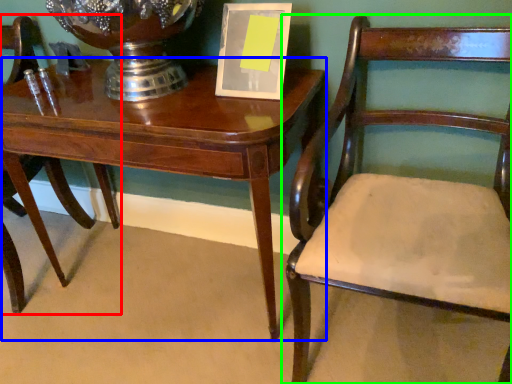
Question: Estimate the real-world distances between objects in this image. Which object is farther from chair (highlighted by a red box), table (highlighted by a blue box) or chair (highlighted by a green box)?

Choices:
 (A) table
 (B) chair

Answer: (B)